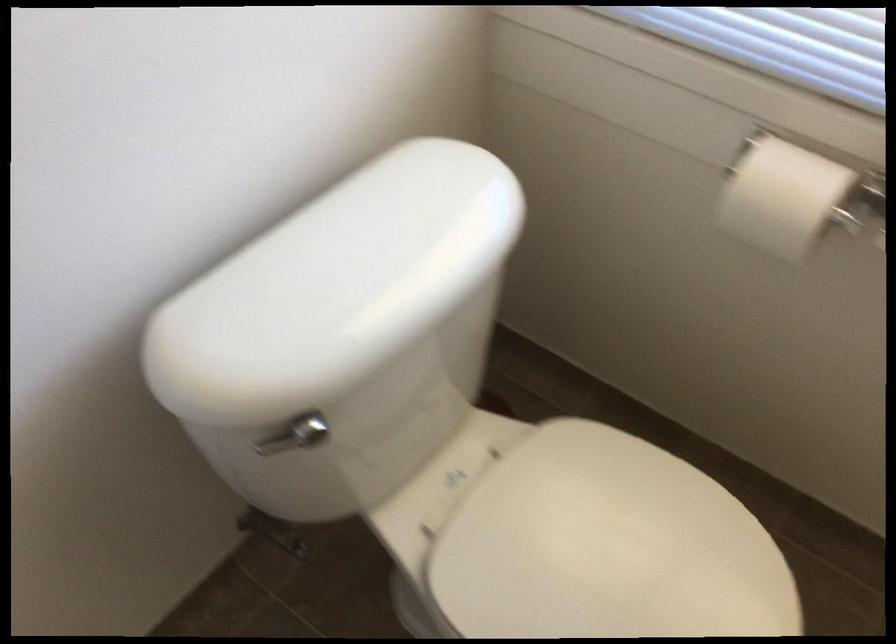
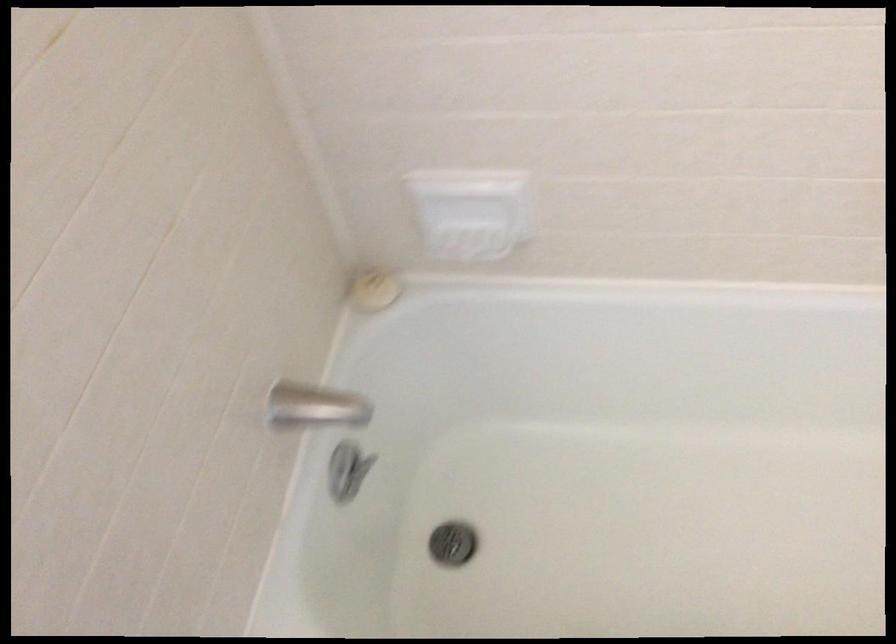
Based on the photo, based on the continuous images, in which direction is the camera rotating?

The camera rotated toward right-down.